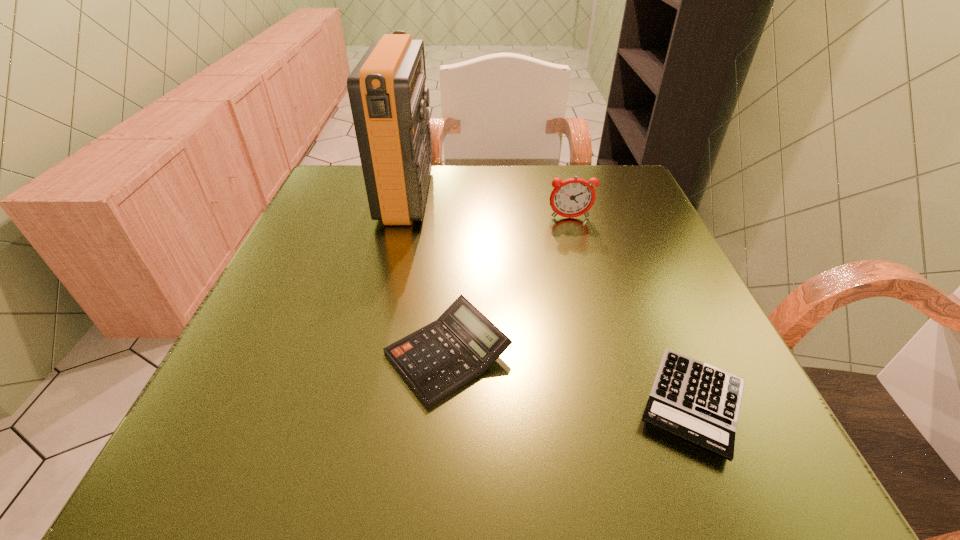
You are a GUI agent. You are given a task and a screenshot of the screen. Output one action in this format:
    pyautogui.click(x=<x>, y=<y>)
    Task: Click on the vacant space that is in between the right calculator and the taller calculator
    This screenshot has width=960, height=540.
    Given the screenshot: What is the action you would take?
    pyautogui.click(x=571, y=379)

Identify the location of vacant area that lies between the shorter calculator and the left calculator. The height and width of the screenshot is (540, 960). (571, 379).

Locate an element on the screen. This screenshot has height=540, width=960. free space between the taller calculator and the alarm clock is located at coordinates (509, 286).

Where is `empty space that is in between the taller calculator and the alarm clock`? The image size is (960, 540). empty space that is in between the taller calculator and the alarm clock is located at coordinates (509, 286).

The width and height of the screenshot is (960, 540). In order to click on free space between the third shortest object and the tallest object in this screenshot , I will do `click(489, 206)`.

Locate which object is the closest to the second tallest object. Please provide its 2D coordinates. Your answer should be formatted as a tuple, i.e. [(x, y)], where the tuple contains the x and y coordinates of a point satisfying the conditions above.

[(388, 98)]

Locate which object ranks second in proximity to the radio receiver. Please provide its 2D coordinates. Your answer should be formatted as a tuple, i.e. [(x, y)], where the tuple contains the x and y coordinates of a point satisfying the conditions above.

[(573, 197)]

Identify the location of vacant space that satisfies the following two spatial constraints: 1. on the front-facing side of the radio receiver; 2. on the back side of the shorter calculator. This screenshot has width=960, height=540. (357, 403).

You are a GUI agent. You are given a task and a screenshot of the screen. Output one action in this format:
    pyautogui.click(x=<x>, y=<y>)
    Task: Click on the vacant space that satisfies the following two spatial constraints: 1. on the front side of the third tallest object; 2. on the left side of the right calculator
    The image size is (960, 540).
    Given the screenshot: What is the action you would take?
    pyautogui.click(x=444, y=403)

Locate an element on the screen. This screenshot has height=540, width=960. vacant position in the image that satisfies the following two spatial constraints: 1. on the front-facing side of the shorter calculator; 2. on the right side of the alarm clock is located at coordinates (621, 403).